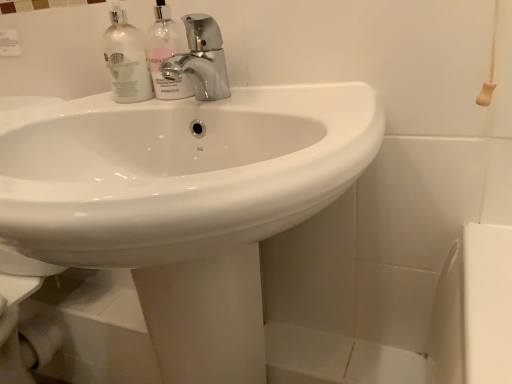
Where is `translucent glass bottles at upper left, which is the second cleaning product from right to left`? Image resolution: width=512 pixels, height=384 pixels. translucent glass bottles at upper left, which is the second cleaning product from right to left is located at coordinates (126, 59).

Locate an element on the screen. Image resolution: width=512 pixels, height=384 pixels. clear glass bottle at upper center, which is counted as the first cleaning product, starting from the right is located at coordinates pos(165,54).

Identify the location of white glossy sink at center. (184, 202).

Find the location of a particular element. sink below the clear glass bottle at upper center, which is counted as the first cleaning product, starting from the right (from a real-world perspective) is located at coordinates (184, 202).

Is clear glass bottle at upper center, positioned as the second cleaning product in left-to-right order, with white glossy sink at center?

clear glass bottle at upper center, positioned as the second cleaning product in left-to-right order, and white glossy sink at center are clearly separated.

Does clear glass bottle at upper center, positioned as the second cleaning product in left-to-right order, have a smaller size compared to white glossy sink at center?

Correct, clear glass bottle at upper center, positioned as the second cleaning product in left-to-right order, occupies less space than white glossy sink at center.

Between clear glass bottle at upper center, positioned as the second cleaning product in left-to-right order, and white glossy sink at center, which one has smaller width?

clear glass bottle at upper center, positioned as the second cleaning product in left-to-right order, is thinner.

Which is closer, (116, 71) or (162, 311)?

The point (162, 311) is in front.

Is translucent glass bottles at upper left, which is the second cleaning product from right to left, further to the viewer compared to white glossy sink at center?

That is True.

Is translucent glass bottles at upper left, which is counted as the 1th cleaning product, starting from the left, oriented towards white glossy sink at center?

No, translucent glass bottles at upper left, which is counted as the 1th cleaning product, starting from the left, is not facing towards white glossy sink at center.

Are translucent glass bottles at upper left, which is counted as the 1th cleaning product, starting from the left, and white glossy sink at center located far from each other?

No, there isn't a large distance between translucent glass bottles at upper left, which is counted as the 1th cleaning product, starting from the left, and white glossy sink at center.

Considering the positions of objects chrome metallic faucet at center and white glossy sink at center in the image provided, who is more to the right, chrome metallic faucet at center or white glossy sink at center?

chrome metallic faucet at center.

In the image, is chrome metallic faucet at center positioned in front of or behind white glossy sink at center?

Clearly, chrome metallic faucet at center is behind white glossy sink at center.

From the image's perspective, would you say chrome metallic faucet at center is shown under white glossy sink at center?

No.

How many degrees apart are the facing directions of chrome metallic faucet at center and white glossy sink at center?

The facing directions of chrome metallic faucet at center and white glossy sink at center are 0.132 degrees apart.

Is chrome metallic faucet at center facing away from translucent glass bottles at upper left, which is the second cleaning product from right to left?

No, chrome metallic faucet at center is not facing the opposite direction of translucent glass bottles at upper left, which is the second cleaning product from right to left.

Which point is more forward, (224, 67) or (139, 74)?

The point (139, 74) is closer to the camera.

Is chrome metallic faucet at center positioned in front of translucent glass bottles at upper left, which is counted as the 1th cleaning product, starting from the left?

Yes, it is in front of translucent glass bottles at upper left, which is counted as the 1th cleaning product, starting from the left.

Is chrome metallic faucet at center situated inside translucent glass bottles at upper left, which is counted as the 1th cleaning product, starting from the left, or outside?

chrome metallic faucet at center cannot be found inside translucent glass bottles at upper left, which is counted as the 1th cleaning product, starting from the left.

How far apart are clear glass bottle at upper center, which is counted as the first cleaning product, starting from the right, and chrome metallic faucet at center?

A distance of 2.40 inches exists between clear glass bottle at upper center, which is counted as the first cleaning product, starting from the right, and chrome metallic faucet at center.

Considering the sizes of objects clear glass bottle at upper center, which is counted as the first cleaning product, starting from the right, and chrome metallic faucet at center in the image provided, who is thinner, clear glass bottle at upper center, which is counted as the first cleaning product, starting from the right, or chrome metallic faucet at center?

With smaller width is clear glass bottle at upper center, which is counted as the first cleaning product, starting from the right.

Considering the sizes of objects clear glass bottle at upper center, which is counted as the first cleaning product, starting from the right, and chrome metallic faucet at center in the image provided, who is bigger, clear glass bottle at upper center, which is counted as the first cleaning product, starting from the right, or chrome metallic faucet at center?

chrome metallic faucet at center is bigger.

Which is in front, point (195, 27) or point (165, 33)?

Point (195, 27)

In the scene shown: Is chrome metallic faucet at center smaller than clear glass bottle at upper center, positioned as the second cleaning product in left-to-right order?

Actually, chrome metallic faucet at center might be larger than clear glass bottle at upper center, positioned as the second cleaning product in left-to-right order.

From a real-world perspective, is chrome metallic faucet at center physically located above or below clear glass bottle at upper center, positioned as the second cleaning product in left-to-right order?

In terms of real-world spatial position, chrome metallic faucet at center is below clear glass bottle at upper center, positioned as the second cleaning product in left-to-right order.

Does chrome metallic faucet at center have a greater height compared to clear glass bottle at upper center, positioned as the second cleaning product in left-to-right order?

No.

Is clear glass bottle at upper center, positioned as the second cleaning product in left-to-right order, surrounding translucent glass bottles at upper left, which is the second cleaning product from right to left?

Definitely not — translucent glass bottles at upper left, which is the second cleaning product from right to left, is not inside clear glass bottle at upper center, positioned as the second cleaning product in left-to-right order.

Who is taller, clear glass bottle at upper center, positioned as the second cleaning product in left-to-right order, or translucent glass bottles at upper left, which is counted as the 1th cleaning product, starting from the left?

clear glass bottle at upper center, positioned as the second cleaning product in left-to-right order, is taller.

Considering the positions of objects clear glass bottle at upper center, which is counted as the first cleaning product, starting from the right, and translucent glass bottles at upper left, which is the second cleaning product from right to left, in the image provided, who is behind, clear glass bottle at upper center, which is counted as the first cleaning product, starting from the right, or translucent glass bottles at upper left, which is the second cleaning product from right to left,?

translucent glass bottles at upper left, which is the second cleaning product from right to left, is more distant.

Can you tell me how much clear glass bottle at upper center, positioned as the second cleaning product in left-to-right order, and translucent glass bottles at upper left, which is counted as the 1th cleaning product, starting from the left, differ in facing direction?

There is a 0.00283-degree angle between the facing directions of clear glass bottle at upper center, positioned as the second cleaning product in left-to-right order, and translucent glass bottles at upper left, which is counted as the 1th cleaning product, starting from the left.

Which cleaning product is the 1st one when counting from the left side of the white glossy sink at center? Please provide its 2D coordinates.

[(165, 54)]

Identify the location of sink in front of the translucent glass bottles at upper left, which is the second cleaning product from right to left. This screenshot has height=384, width=512. (184, 202).

When comparing their distances from white glossy sink at center, does chrome metallic faucet at center or clear glass bottle at upper center, positioned as the second cleaning product in left-to-right order, seem closer?

chrome metallic faucet at center is closer to white glossy sink at center.

Based on their spatial positions, is translucent glass bottles at upper left, which is counted as the 1th cleaning product, starting from the left, or white glossy sink at center closer to chrome metallic faucet at center?

translucent glass bottles at upper left, which is counted as the 1th cleaning product, starting from the left, is closer to chrome metallic faucet at center.

Looking at the image, which one is located closer to chrome metallic faucet at center, translucent glass bottles at upper left, which is the second cleaning product from right to left, or clear glass bottle at upper center, positioned as the second cleaning product in left-to-right order?

clear glass bottle at upper center, positioned as the second cleaning product in left-to-right order, is closer to chrome metallic faucet at center.

Estimate the real-world distances between objects in this image. Which object is further from translucent glass bottles at upper left, which is counted as the 1th cleaning product, starting from the left, chrome metallic faucet at center or clear glass bottle at upper center, which is counted as the first cleaning product, starting from the right?

chrome metallic faucet at center lies further to translucent glass bottles at upper left, which is counted as the 1th cleaning product, starting from the left, than the other object.

Considering their positions, is white glossy sink at center positioned further to chrome metallic faucet at center than translucent glass bottles at upper left, which is counted as the 1th cleaning product, starting from the left?

Among the two, white glossy sink at center is located further to chrome metallic faucet at center.

When comparing their distances from translucent glass bottles at upper left, which is the second cleaning product from right to left, does clear glass bottle at upper center, which is counted as the first cleaning product, starting from the right, or white glossy sink at center seem further?

white glossy sink at center is positioned further to the anchor translucent glass bottles at upper left, which is the second cleaning product from right to left.

Looking at the image, which one is located closer to white glossy sink at center, clear glass bottle at upper center, positioned as the second cleaning product in left-to-right order, or chrome metallic faucet at center?

chrome metallic faucet at center is positioned closer to the anchor white glossy sink at center.

Consider the image. Based on their spatial positions, is translucent glass bottles at upper left, which is the second cleaning product from right to left, or white glossy sink at center further from clear glass bottle at upper center, positioned as the second cleaning product in left-to-right order?

white glossy sink at center is positioned further to the anchor clear glass bottle at upper center, positioned as the second cleaning product in left-to-right order.

Identify the location of cleaning product between translucent glass bottles at upper left, which is counted as the 1th cleaning product, starting from the left, and chrome metallic faucet at center, in the horizontal direction. This screenshot has height=384, width=512. pos(165,54).

Identify the location of cleaning product between clear glass bottle at upper center, which is counted as the first cleaning product, starting from the right, and white glossy sink at center in the up-down direction. (126, 59).

The image size is (512, 384). Identify the location of tap between translucent glass bottles at upper left, which is the second cleaning product from right to left, and white glossy sink at center vertically. (201, 59).

Locate an element on the screen. The image size is (512, 384). tap between clear glass bottle at upper center, which is counted as the first cleaning product, starting from the right, and white glossy sink at center vertically is located at coordinates (201, 59).